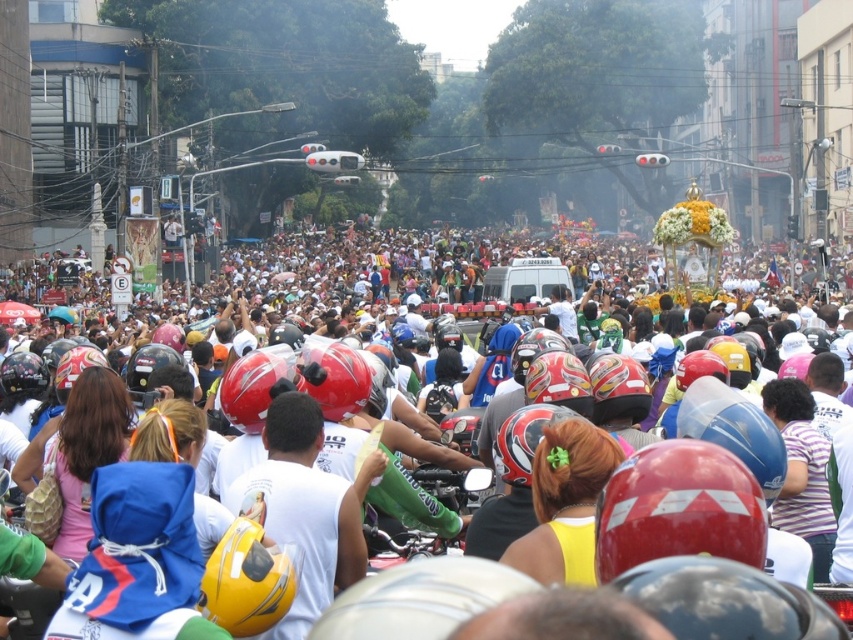
You are standing at the point closest to you in the scene. There are two points marked in the image, point A at coordinates point A is point [479,522] and point B at coordinates point B is point [529,467]. Which point is farther away from you?

Point A at coordinates point A is point [479,522] is farther away because it is behind point B at coordinates point B is point [529,467].

You are a photographer standing at the front of the scene. You want to take a photo that includes both the decorative float at center and the glossy red helmet at center. Which object should you focus on first to ensure both are in clear view?

The decorative float at center is closer to the viewer than the glossy red helmet at center, so you should focus on the decorative float at center first to ensure both are in clear view.

You are a delivery person who needs to navigate through the crowd to reach the green matte motorcycle at center. Given the coordinates provided, can you estimate how far you are from the motorcycle?

The green matte motorcycle at center is located at coordinates point [418,513], so you can use these coordinates to navigate towards it, but the exact distance cannot be determined without additional information about the scale or units of the coordinate system.